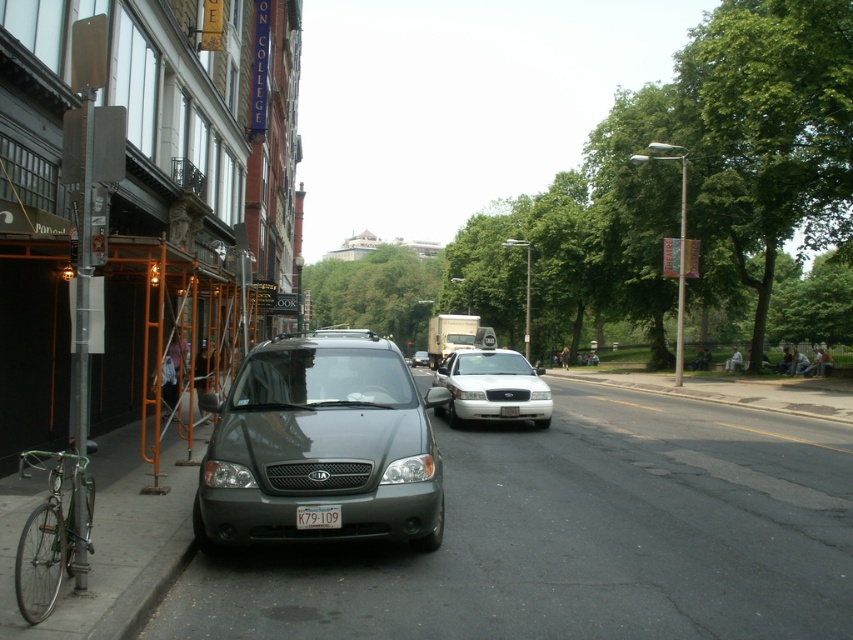
Question: Which of the following is the closest to the observer?

Choices:
 (A) (538, 384)
 (B) (318, 506)
 (C) (57, 630)
 (D) (444, 596)

Answer: (C)

Question: Can you confirm if yellow matte license plate at center is thinner than silver metallic minivan at center?

Choices:
 (A) yes
 (B) no

Answer: (A)

Question: Can you confirm if gray asphalt pavement at lower left is wider than satin gray minivan at center?

Choices:
 (A) no
 (B) yes

Answer: (B)

Question: Which point appears farthest from the camera in this image?

Choices:
 (A) (325, 506)
 (B) (419, 364)
 (C) (508, 404)

Answer: (B)

Question: Which object is closer to the camera taking this photo?

Choices:
 (A) white plastic license plate at center
 (B) yellow matte license plate at center

Answer: (B)

Question: Does satin gray minivan at center have a greater width compared to white glossy taxi at center?

Choices:
 (A) no
 (B) yes

Answer: (B)